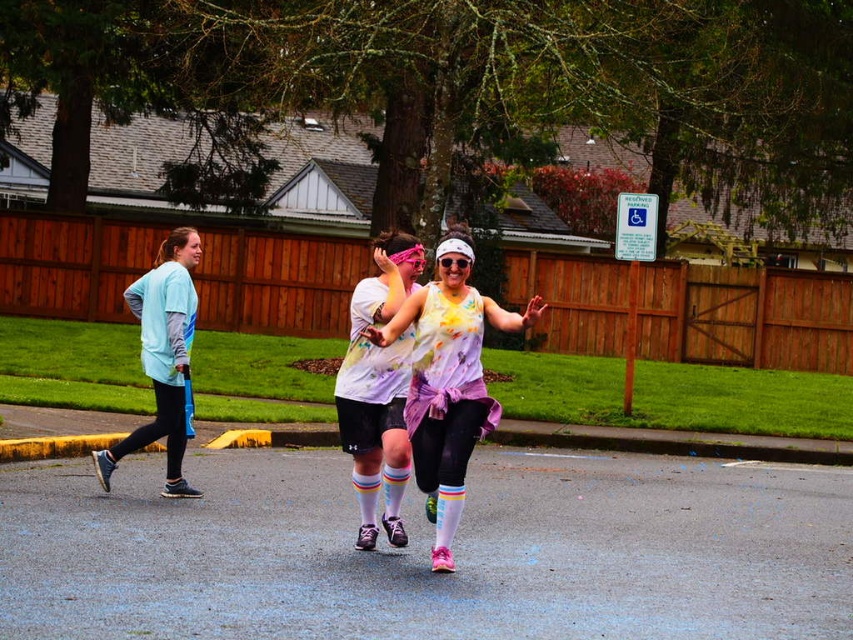
Is rainbow-patterned leggings at center behind rainbow striped socks at center?

No.

Who is more distant from viewer, (x=463, y=253) or (x=421, y=248)?

Point (x=421, y=248)

I want to click on rainbow-patterned leggings at center, so click(x=448, y=381).

Which is above, rainbow striped socks at center or light blue fabric shirt at left?

light blue fabric shirt at left is above.

Who is positioned more to the left, rainbow striped socks at center or light blue fabric shirt at left?

light blue fabric shirt at left

Is point (403, 374) behind point (198, 241)?

No, it is in front of (198, 241).

Identify the location of rainbow striped socks at center. Image resolution: width=853 pixels, height=640 pixels. (378, 388).

Can you confirm if rainbow-patterned leggings at center is shorter than light blue fabric shirt at left?

Yes.

Is rainbow-patterned leggings at center to the left of light blue fabric shirt at left from the viewer's perspective?

No, rainbow-patterned leggings at center is not to the left of light blue fabric shirt at left.

Which is behind, point (438, 273) or point (189, 337)?

The point (189, 337) is behind.

At what (x,y) coordinates should I click in order to perform the action: click on rainbow-patterned leggings at center. Please return your answer as a coordinate pair (x, y). The width and height of the screenshot is (853, 640). Looking at the image, I should click on (448, 381).